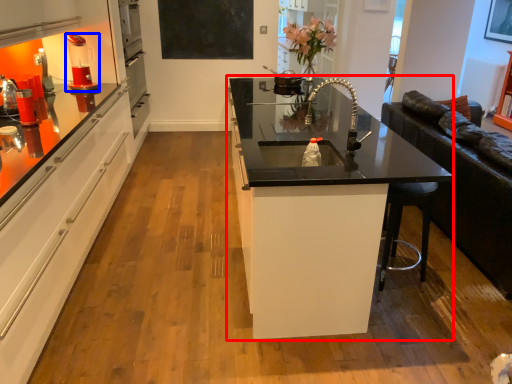
Question: Which object is further to the camera taking this photo, countertop (highlighted by a red box) or coffee machine (highlighted by a blue box)?

Choices:
 (A) countertop
 (B) coffee machine

Answer: (B)